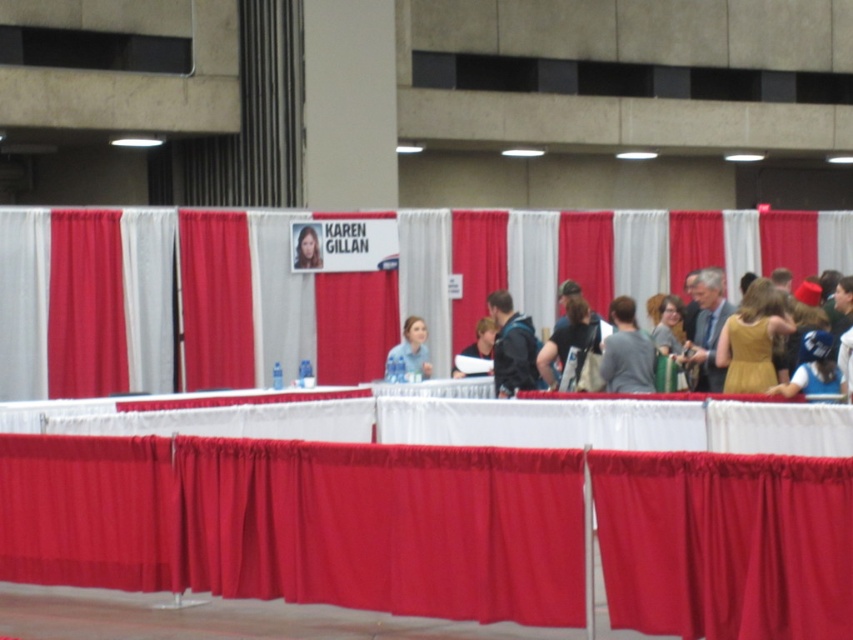
Does gray matte shirt at center have a lesser width compared to smooth skin portrait at center?

No, gray matte shirt at center is not thinner than smooth skin portrait at center.

Who is positioned more to the right, gray matte shirt at center or smooth skin portrait at center?

gray matte shirt at center is more to the right.

Where is `gray matte shirt at center`? gray matte shirt at center is located at coordinates (625, 352).

Looking at this image, is red fabric tablecloth at center further to the viewer compared to blue fabric at center?

No, red fabric tablecloth at center is in front of blue fabric at center.

Does red fabric tablecloth at center have a greater height compared to blue fabric at center?

Yes, red fabric tablecloth at center is taller than blue fabric at center.

At what (x,y) coordinates should I click in order to perform the action: click on red fabric tablecloth at center. Please return your answer as a coordinate pair (x, y). The height and width of the screenshot is (640, 853). Looking at the image, I should click on (440, 529).

This screenshot has width=853, height=640. I want to click on red fabric tablecloth at center, so click(x=440, y=529).

Does matte gold dress at center have a lesser width compared to smooth skin portrait at center?

No.

Which of these two, matte gold dress at center or smooth skin portrait at center, stands shorter?

Standing shorter between the two is smooth skin portrait at center.

Is point (693, 326) positioned behind point (299, 252)?

No.

The image size is (853, 640). In order to click on matte gold dress at center in this screenshot , I will do `click(708, 328)`.